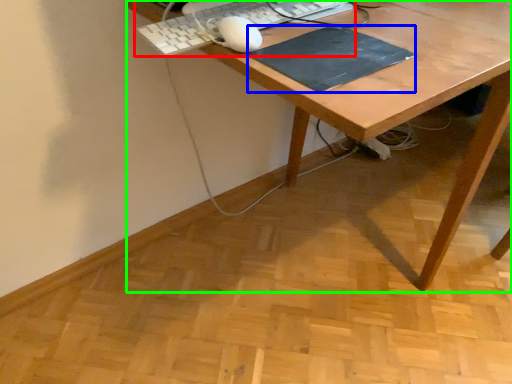
Question: Which object is positioned closest to computer keyboard (highlighted by a red box)? Select from mousepad (highlighted by a blue box) and desk (highlighted by a green box).

Choices:
 (A) mousepad
 (B) desk

Answer: (A)